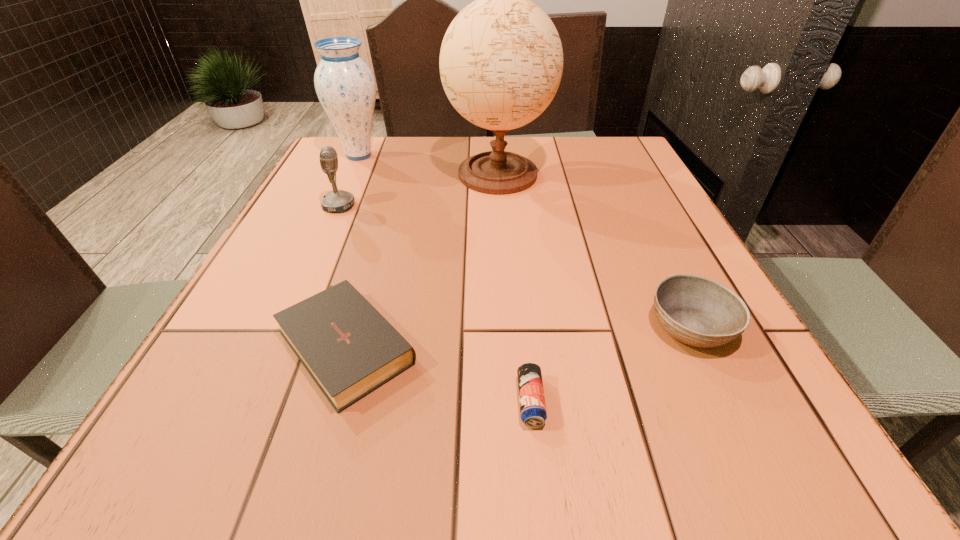
At what (x,y) coordinates should I click in order to perform the action: click on object positioned at the far left corner. Please return your answer as a coordinate pair (x, y). Looking at the image, I should click on (345, 85).

Locate an element on the screen. Image resolution: width=960 pixels, height=540 pixels. free space at the far edge is located at coordinates (423, 152).

In the image, there is a desktop. At what (x,y) coordinates should I click in order to perform the action: click on vacant space at the near edge. Please return your answer as a coordinate pair (x, y). The width and height of the screenshot is (960, 540). Looking at the image, I should click on (690, 477).

In the image, there is a desktop. Where is `vacant space at the left edge`? The image size is (960, 540). vacant space at the left edge is located at coordinates (260, 313).

Identify the location of vacant point at the right edge. Image resolution: width=960 pixels, height=540 pixels. (728, 369).

Find the location of `vacant space at the far left corner`. vacant space at the far left corner is located at coordinates (328, 145).

This screenshot has height=540, width=960. What are the coordinates of `vacant space at the far right corner` in the screenshot? It's located at (592, 161).

This screenshot has height=540, width=960. I want to click on unoccupied area between the Bible and the tallest object, so click(422, 258).

Find the location of a particular element. The width and height of the screenshot is (960, 540). free space between the fifth shortest object and the fourth shortest object is located at coordinates (348, 180).

Locate an element on the screen. This screenshot has width=960, height=540. free spot between the beer can and the third shortest object is located at coordinates (611, 364).